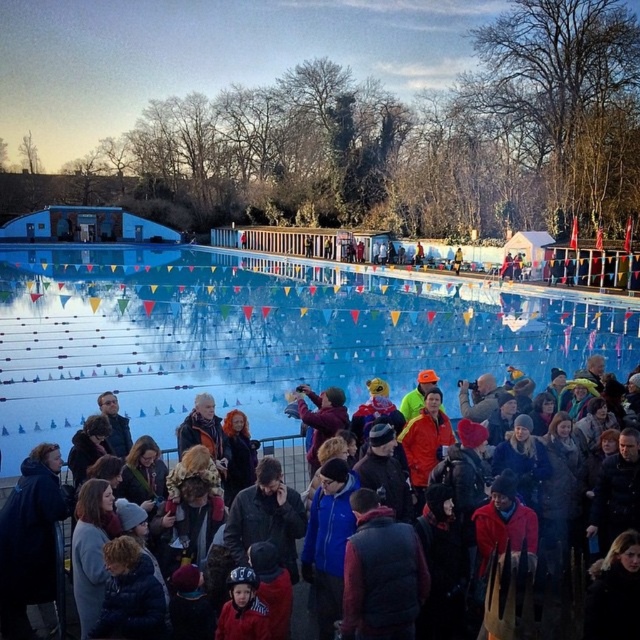
You are standing at the edge of the pool and want to locate two specific points marked in the image. The first point is at coordinates point (481, 342) and the second is at point (612, 364). From your current position, which point is closer to you?

Point (612, 364) is closer to you because it is in front of point (481, 342) according to the spatial relationship provided.

You are a swimmer preparing to dive into the pool. You see the blue smooth water at center and the dark blue fabric crowd at lower center. Which one is higher from the ground?

The blue smooth water at center is much taller than the dark blue fabric crowd at lower center, so the blue smooth water at center is higher from the ground.